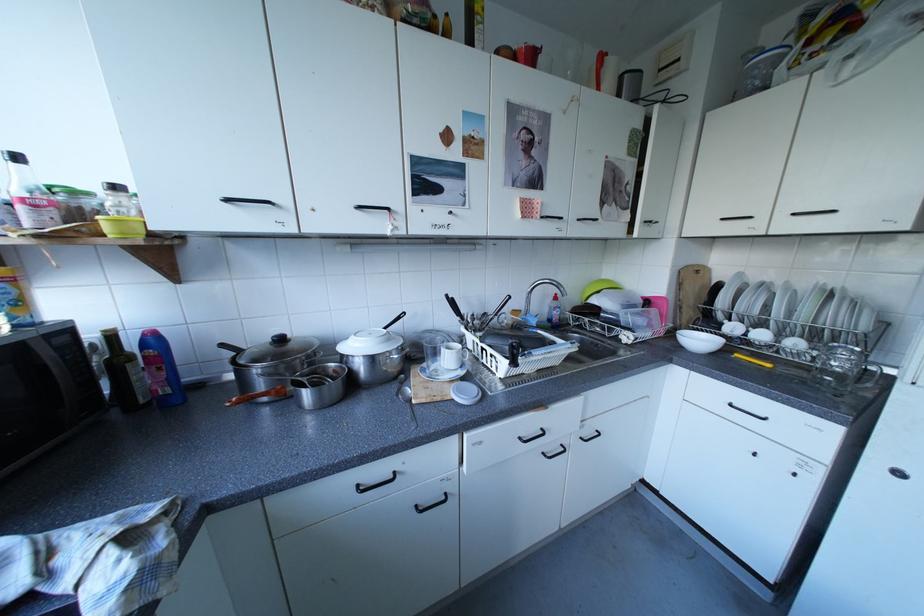
Where is `white mug handle`? white mug handle is located at coordinates (451, 355).